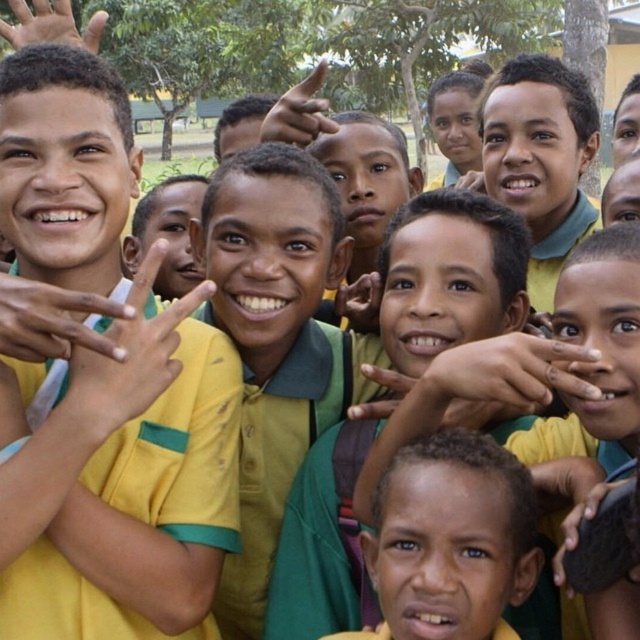
Question: Is yellow-green shirt at center bigger than yellow-green fabric hand at center-left?

Choices:
 (A) yes
 (B) no

Answer: (A)

Question: Estimate the real-world distances between objects in this image. Which object is closer to the matte yellow hand at center?

Choices:
 (A) yellow-green fabric hand at center-left
 (B) yellow fabric hand at center
 (C) yellow-green shirt at center

Answer: (C)

Question: Does yellow fabric hand at center appear on the right side of matte yellow hand at center?

Choices:
 (A) yes
 (B) no

Answer: (B)

Question: Which point is farther to the camera?

Choices:
 (A) (356, 282)
 (B) (6, 22)
 (C) (308, 99)
 (D) (74, 307)

Answer: (B)

Question: Based on their relative distances, which object is nearer to the smooth skin hand at upper left?

Choices:
 (A) yellow matte shirt at center
 (B) yellow-green fabric hand at center-left
 (C) smooth skin hand at center

Answer: (B)

Question: Can you confirm if yellow matte shirt at center is positioned to the right of smooth skin hand at upper left?

Choices:
 (A) no
 (B) yes

Answer: (B)